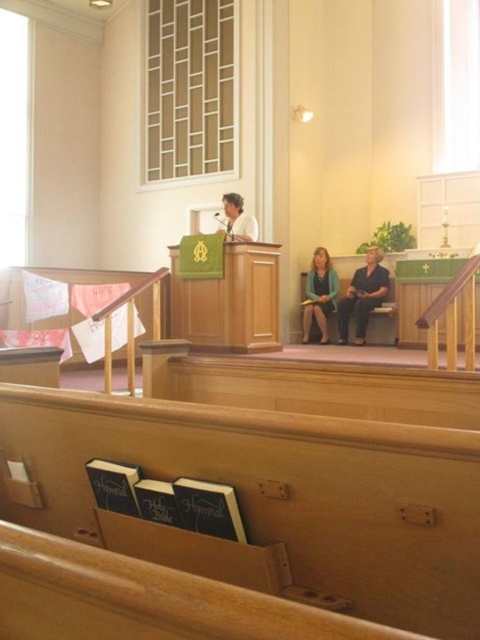
You are attending a church service and notice a green fabric jacket at center. Where exactly is the green fabric jacket located in the church?

The green fabric jacket at center is located at point 0.463 on the horizontal axis and 0.665 on the vertical axis within the image frame.

You are sitting in the church and want to see if you can see the point at [317,250] from the point at [233,240]. Can you see it?

Point at [317,250] is behind point at [233,240], so you cannot see it from there.